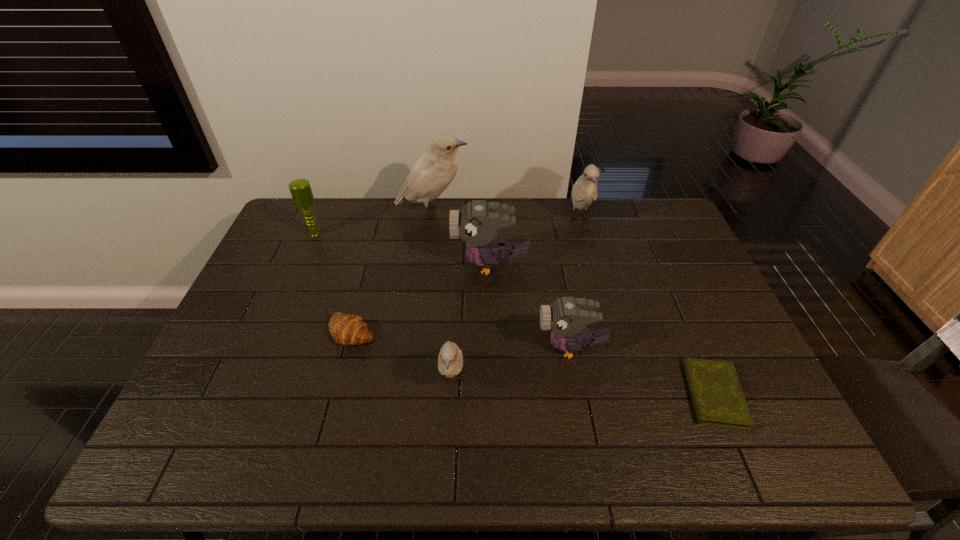
In the image, there is a desktop. At what (x,y) coordinates should I click in order to perform the action: click on vacant space at the far edge. Please return your answer as a coordinate pair (x, y). This screenshot has width=960, height=540. Looking at the image, I should click on (547, 232).

At what (x,y) coordinates should I click in order to perform the action: click on free space at the near edge of the desktop. Please return your answer as a coordinate pair (x, y). The image size is (960, 540). Looking at the image, I should click on (403, 451).

The width and height of the screenshot is (960, 540). What are the coordinates of `free space at the left edge` in the screenshot? It's located at (205, 376).

Where is `vacant space at the right edge of the desktop`? The width and height of the screenshot is (960, 540). vacant space at the right edge of the desktop is located at coordinates (711, 321).

Identify the location of vacant space at the near left corner of the desktop. (169, 463).

At what (x,y) coordinates should I click in order to perform the action: click on vacant space at the far right corner of the desktop. Please return your answer as a coordinate pair (x, y). The image size is (960, 540). Looking at the image, I should click on (636, 207).

You are a GUI agent. You are given a task and a screenshot of the screen. Output one action in this format:
    pyautogui.click(x=<x>, y=<y>)
    Task: Click on the free space between the crescent roll and the biggest white bird
    
    Given the screenshot: What is the action you would take?
    pyautogui.click(x=393, y=271)

Where is `vacant region between the nearer gray bird and the tallest bird`? The height and width of the screenshot is (540, 960). vacant region between the nearer gray bird and the tallest bird is located at coordinates (502, 280).

Locate an element on the screen. free space that is in between the microphone and the tallest bird is located at coordinates tap(373, 223).

The height and width of the screenshot is (540, 960). I want to click on empty space between the tallest bird and the crescent roll, so click(393, 271).